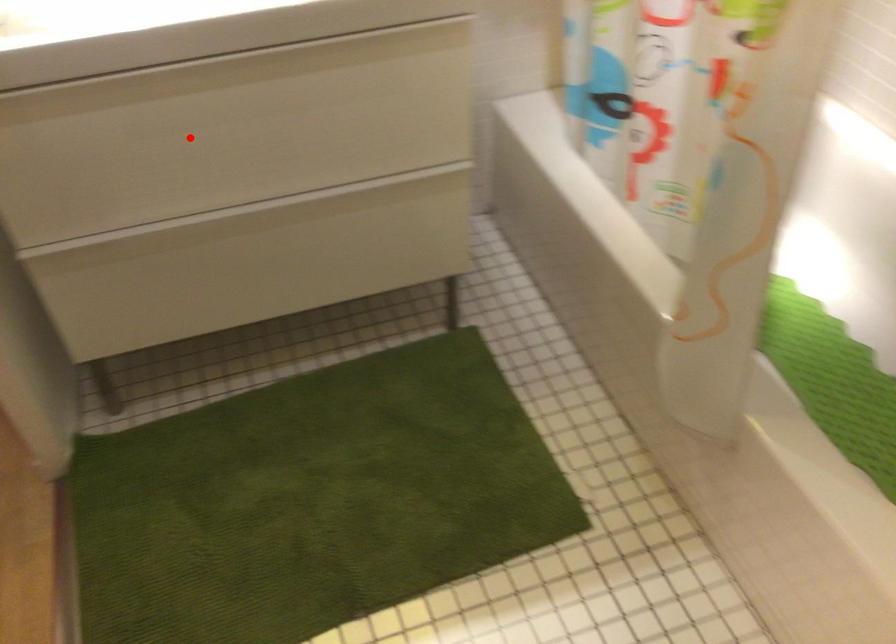
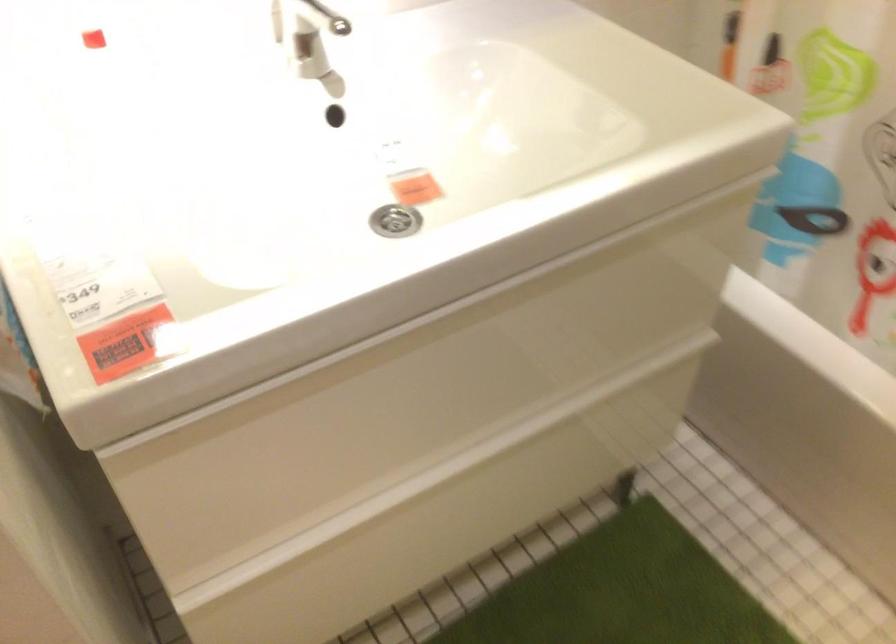
Find the pixel in the second image that matches the highlighted location in the first image.

(423, 392)